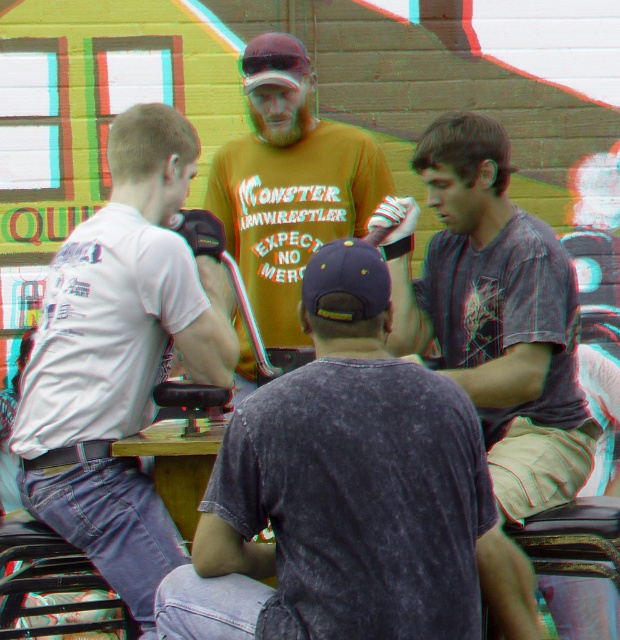
In the scene shown: What is the 2D coordinate of the dark gray speckled shirt at center in the image?

The 2D coordinate of the dark gray speckled shirt at center is at point [347,492].